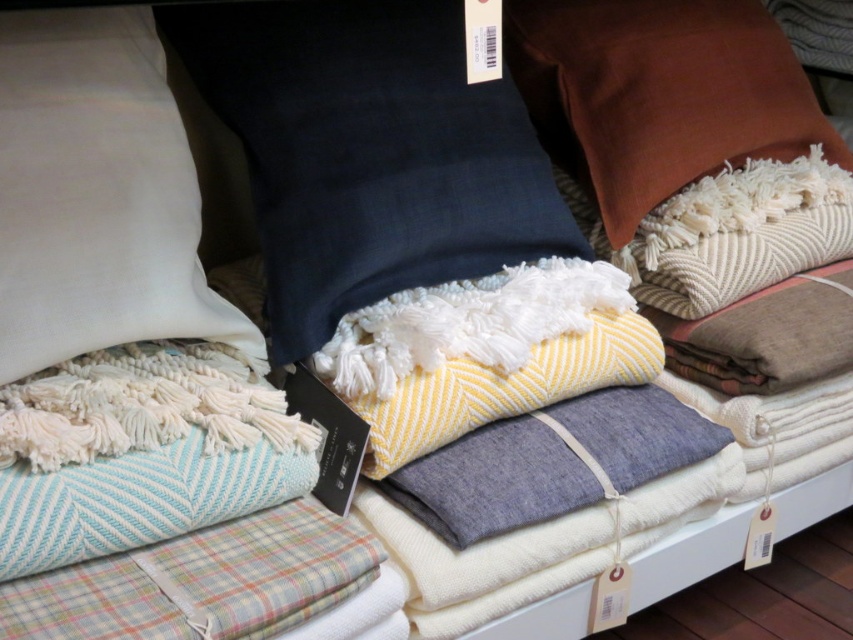
Based on the photo, you are standing in front of the textiles display. There are two points marked in the image. One is at coordinate point [451,188] and the other at point [67,266]. Which point is closer to you?

Point [67,266] is closer to you because it is in the foreground compared to point [451,188], which is behind it.

You are a customer in a store looking at the textiles. You want to pick up the navy blue linen pillow at upper center first. Is it closer to you than the white cotton pillow at upper left?

The navy blue linen pillow at upper center is further to the viewer than white cotton pillow at upper left, so yes, it is closer to you and can be picked up first.

You are a customer in a store looking at the textiles display. You see a navy blue linen pillow marked at point [368,152]. Can you determine if this pillow is placed above or below the folded blankets in the foreground?

The point [368,152] marks the navy blue linen pillow at upper center, which is located behind the folded blankets in the foreground. Therefore, the pillow is placed above the blankets.